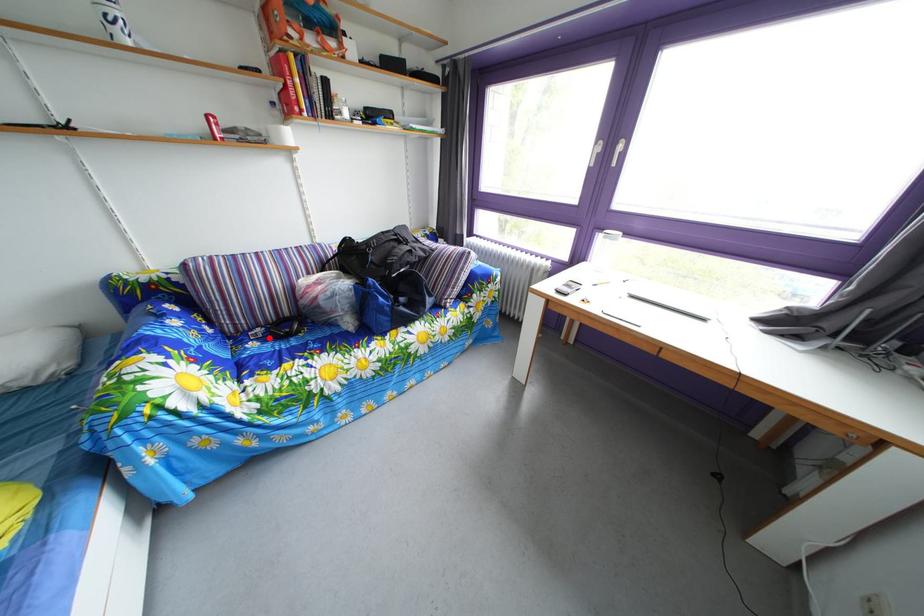
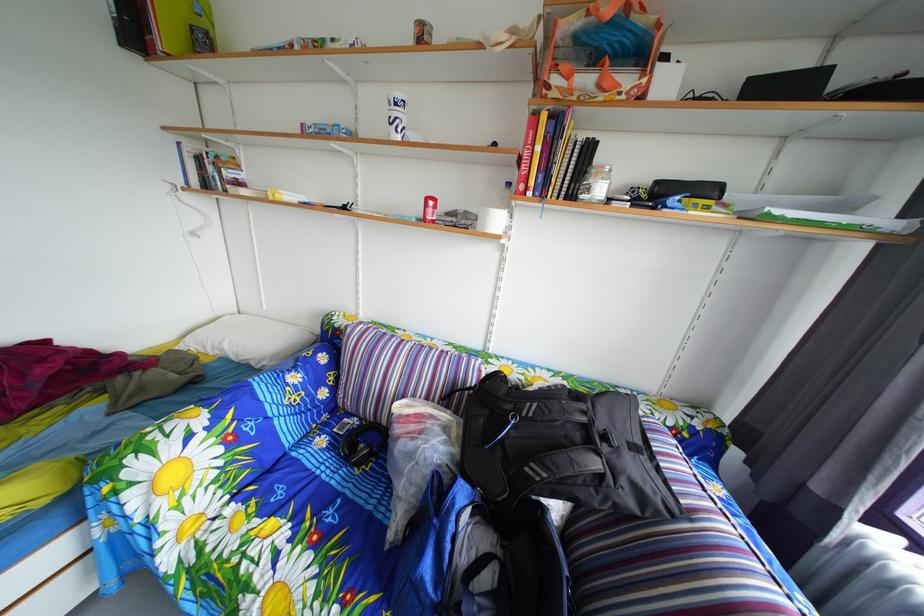
In the second image, find the point that corresponds to the highlighted location in the first image.

(367, 428)